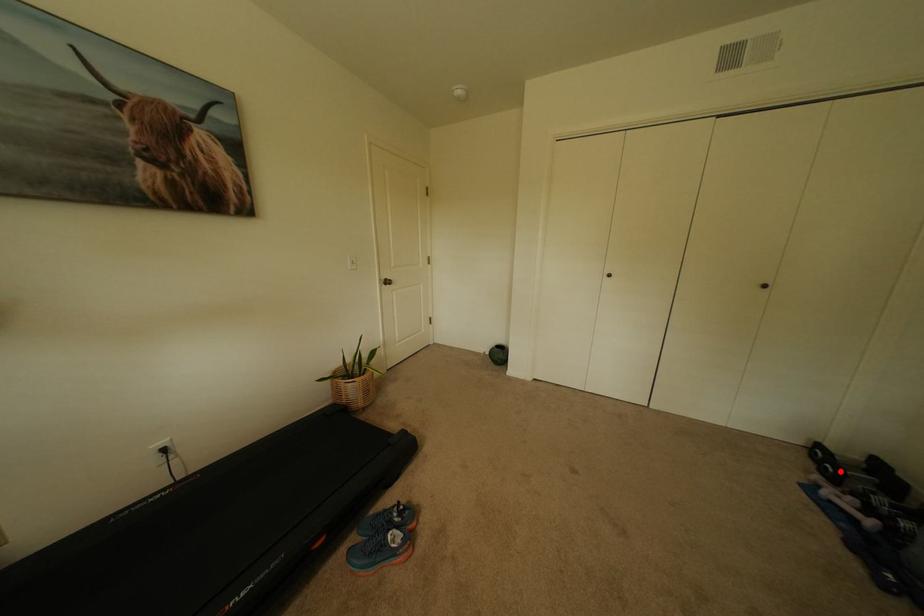
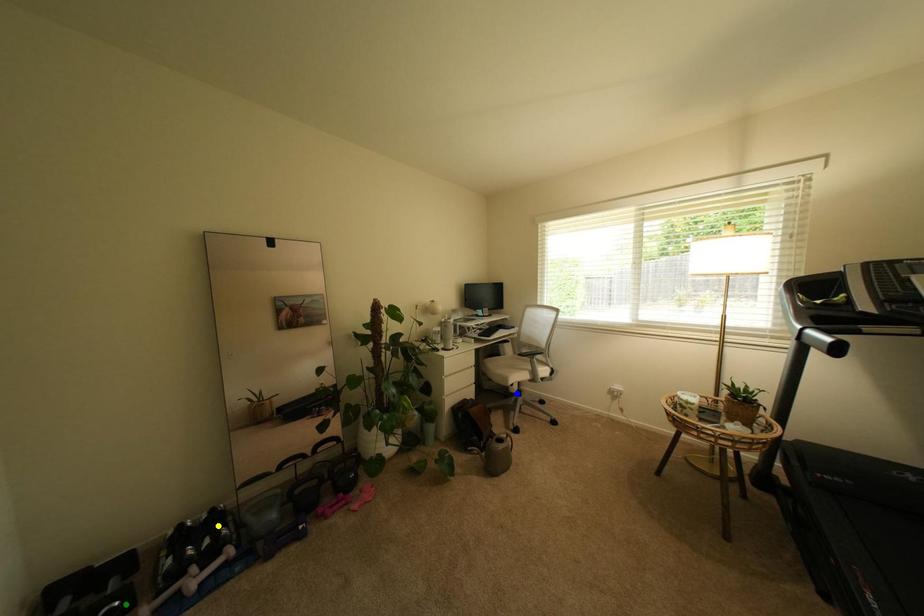
Question: I am providing you with two images of the same scene from different viewpoints. A red point is marked on the first image. You are given multiple points on the second image. Which point in image 2 represents the same 3d spot as the red point in image 1?

Choices:
 (A) green point
 (B) blue point
 (C) yellow point

Answer: (A)